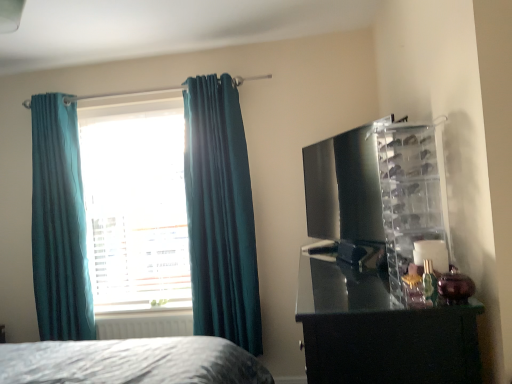
Question: From the image's perspective, is white matte radiator at lower left positioned above or below glossy black dresser at right?

Choices:
 (A) below
 (B) above

Answer: (A)

Question: Is white matte radiator at lower left situated inside glossy black dresser at right or outside?

Choices:
 (A) outside
 (B) inside

Answer: (A)

Question: Which object is positioned closest to the teal fabric curtain at left, the first curtain from the left?

Choices:
 (A) teal fabric window at center
 (B) glossy black dresser at right
 (C) clear plastic shoe rack at right
 (D) white matte radiator at lower left
 (E) teal velvet curtains at left, which is the 1th curtain from right to left

Answer: (A)

Question: Which is nearer to the teal fabric curtain at left, the first curtain from the left?

Choices:
 (A) glossy black dresser at right
 (B) teal fabric window at center
 (C) clear plastic shoe rack at right
 (D) teal velvet curtains at left, which is the 1th curtain from right to left
 (E) white matte radiator at lower left

Answer: (B)